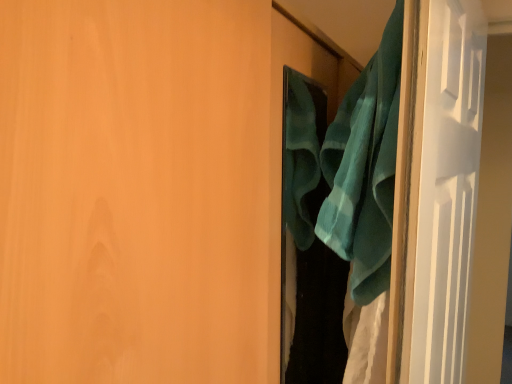
What are the coordinates of `teal fabric at right` in the screenshot? It's located at (143, 188).

The height and width of the screenshot is (384, 512). I want to click on teal soft towel at right, so click(365, 168).

In terms of size, does teal soft towel at right appear bigger or smaller than teal fabric at right?

teal soft towel at right is smaller than teal fabric at right.

Locate an element on the screen. This screenshot has width=512, height=384. screen door on the right of the teal soft towel at right is located at coordinates (446, 186).

From the image's perspective, is teal soft towel at right beneath teal fabric at right?

No, from the image's perspective, teal soft towel at right is not beneath teal fabric at right.

Is teal soft towel at right not near teal fabric at right?

That's not correct — teal soft towel at right is a little close to teal fabric at right.

Which of these two, teal fabric at right or teal fabric at right, is thinner?

Thinner between the two is teal fabric at right.

Which is less distant, (233, 258) or (432, 24)?

Clearly, point (233, 258) is closer to the camera than point (432, 24).

Does teal fabric at right have a greater height compared to teal fabric at right?

No.

Can you confirm if teal fabric at right is bigger than teal fabric at right?

Indeed, teal fabric at right has a larger size compared to teal fabric at right.

Is teal soft towel at right facing away from teal fabric at right?

Yes, teal soft towel at right is positioned with its back facing teal fabric at right.

From a real-world perspective, between teal soft towel at right and teal fabric at right, who is vertically higher?

In real-world perspective, teal soft towel at right is above.

Looking at this image, considering the positions of objects teal soft towel at right and teal fabric at right in the image provided, who is more to the left, teal soft towel at right or teal fabric at right?

From the viewer's perspective, teal fabric at right appears more on the left side.

Would you consider teal fabric at right to be distant from teal soft towel at right?

No, teal fabric at right is not far away from teal soft towel at right.

Measure the distance between teal fabric at right and teal soft towel at right.

They are 21.04 centimeters apart.

From a real-world perspective, who is located higher, teal fabric at right or teal soft towel at right?

teal soft towel at right.

Consider the image. Is teal fabric at right shorter than teal soft towel at right?

In fact, teal fabric at right may be taller than teal soft towel at right.

Based on the photo, from the image's perspective, which one is positioned higher, teal fabric at right or teal fabric at right?

teal fabric at right appears higher in the image.

From a real-world perspective, is teal fabric at right positioned above or below teal fabric at right?

teal fabric at right is above teal fabric at right.

From their relative heights in the image, would you say teal fabric at right is taller or shorter than teal fabric at right?

teal fabric at right is taller than teal fabric at right.

Is teal fabric at right oriented away from teal soft towel at right?

That's right, teal fabric at right is facing away from teal soft towel at right.

Is point (216, 358) closer to viewer compared to point (343, 132)?

Yes, it is in front of point (343, 132).

From a real-world perspective, is teal fabric at right located beneath teal soft towel at right?

Yes.

Can you tell me how much teal fabric at right and teal soft towel at right differ in facing direction?

The angle between the facing direction of teal fabric at right and the facing direction of teal soft towel at right is 5.54 degrees.

What are the coordinates of `beach towel on the left of teal fabric at right` in the screenshot? It's located at (365, 168).

Identify the location of door below the teal fabric at right (from the image's perspective). (143, 188).

Estimate the real-world distances between objects in this image. Which object is closer to teal soft towel at right, teal fabric at right or teal fabric at right?

teal fabric at right.

Consider the image. Based on their spatial positions, is teal soft towel at right or teal fabric at right closer to teal fabric at right?

teal soft towel at right lies closer to teal fabric at right than the other object.

When comparing their distances from teal fabric at right, does teal fabric at right or teal soft towel at right seem further?

Among the two, teal fabric at right is located further to teal fabric at right.

When comparing their distances from teal fabric at right, does teal soft towel at right or teal fabric at right seem closer?

teal soft towel at right is positioned closer to the anchor teal fabric at right.

Looking at the image, which one is located further to teal fabric at right, teal fabric at right or teal soft towel at right?

The object further to teal fabric at right is teal fabric at right.

From the image, which object appears to be farther from teal soft towel at right, teal fabric at right or teal fabric at right?

Among the two, teal fabric at right is located further to teal soft towel at right.

Where is `beach towel between teal fabric at right and teal fabric at right`? This screenshot has height=384, width=512. beach towel between teal fabric at right and teal fabric at right is located at coordinates (365, 168).